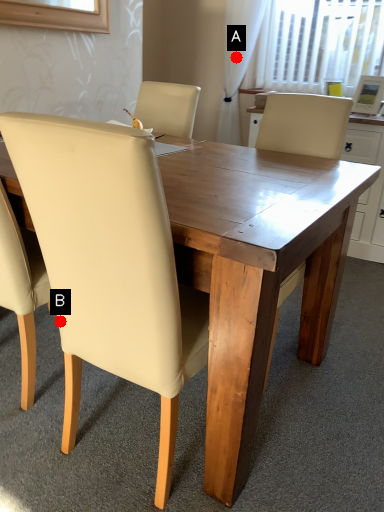
Question: Two points are circled on the image, labeled by A and B beside each circle. Among these points, which one is farthest from the camera?

Choices:
 (A) A is further
 (B) B is further

Answer: (A)